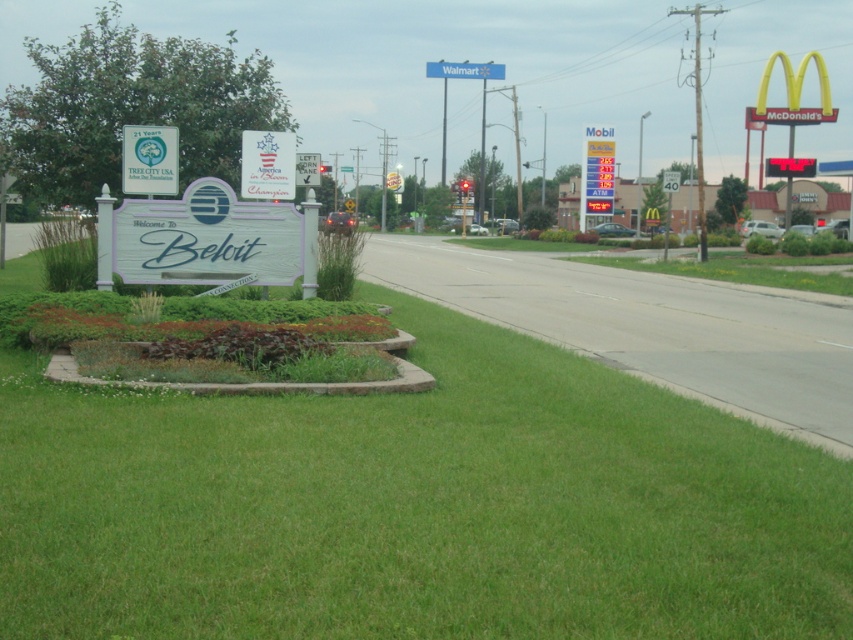
Question: Does green matte sign at upper left appear over metallic silver speed limit sign at right?

Choices:
 (A) no
 (B) yes

Answer: (A)

Question: Which object is farther from the camera taking this photo?

Choices:
 (A) red plastic gas price sign at right
 (B) white plastic sign at center
 (C) green grass at lower center
 (D) green matte sign at upper left

Answer: (A)

Question: Which of the following is the farthest from the observer?

Choices:
 (A) (672, 192)
 (B) (167, 184)
 (C) (606, 138)
 (D) (281, 168)

Answer: (C)

Question: Is white plastic sign at center positioned behind red plastic gas price sign at right?

Choices:
 (A) yes
 (B) no

Answer: (B)

Question: Does green matte sign at upper left have a larger size compared to white plastic sign at center?

Choices:
 (A) yes
 (B) no

Answer: (B)

Question: Which object is the closest to the white plastic sign at center?

Choices:
 (A) green grass at lower center
 (B) green matte sign at upper left
 (C) red plastic gas price sign at right

Answer: (B)